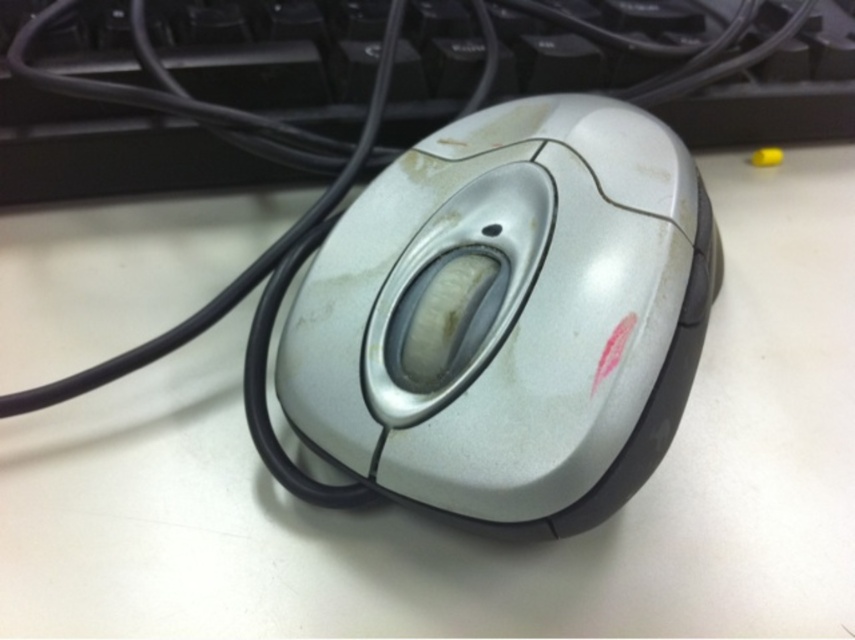
Which is more to the right, slightly worn silver mouse at center or black plastic keyboard at upper center?

slightly worn silver mouse at center is more to the right.

Is slightly worn silver mouse at center further to camera compared to black plastic keyboard at upper center?

No, it is in front of black plastic keyboard at upper center.

Does point (416, 458) lie in front of point (730, 115)?

Yes, point (416, 458) is in front of point (730, 115).

The height and width of the screenshot is (640, 855). Identify the location of slightly worn silver mouse at center. pyautogui.click(x=514, y=316).